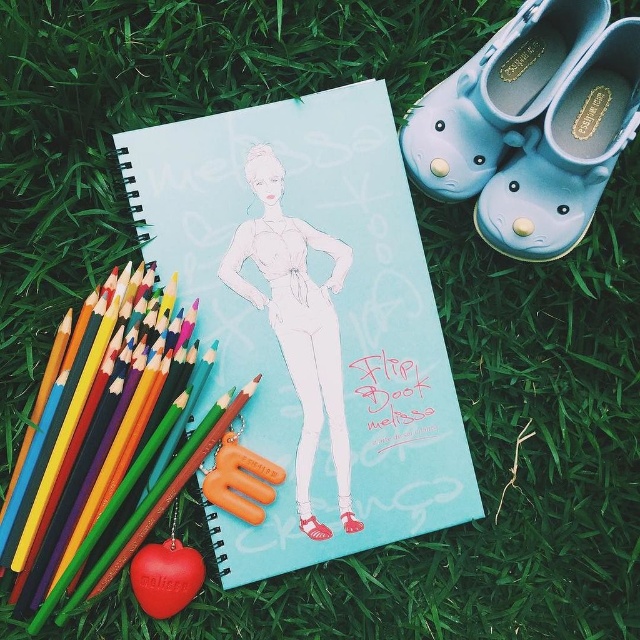
Question: Which of the following is the closest to the observer?

Choices:
 (A) (x=472, y=154)
 (B) (x=296, y=221)

Answer: (A)

Question: Which point appears closest to the camera in this image?

Choices:
 (A) (545, 22)
 (B) (340, 387)

Answer: (A)

Question: From the image, what is the correct spatial relationship of white paper at center in relation to light blue rubber shoe at upper right?

Choices:
 (A) below
 (B) above

Answer: (A)

Question: Is light blue paper at center above matte blue rubber clog at upper right?

Choices:
 (A) yes
 (B) no

Answer: (B)

Question: Which point is closer to the camera taking this photo?

Choices:
 (A) (337, 371)
 (B) (269, 182)

Answer: (B)

Question: Where is white paper at center located in relation to light blue rubber shoe at upper right in the image?

Choices:
 (A) left
 (B) right

Answer: (A)